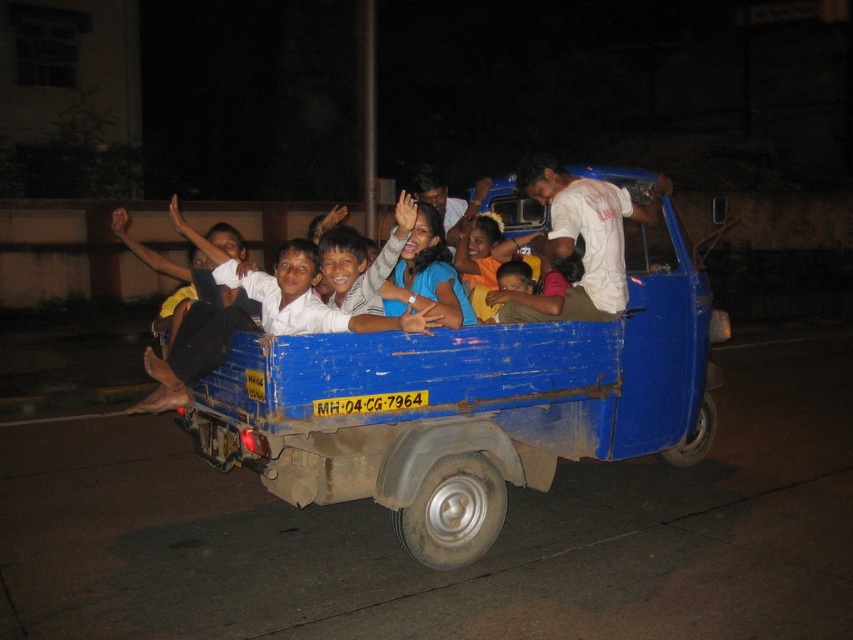
You are a passenger in the blue auto rickshaw and you want to move from the point at coordinate point (633, 336) to the point at coordinate point (585, 188). Which direction should you move in?

The point at coordinate point (633, 336) is behind the point at coordinate point (585, 188). To move from the point at coordinate point (633, 336) to the point at coordinate point (585, 188), you should move forward.

You are a delivery person who needs to place a package between the blue matte truck at center and the white cotton shirt at upper center. The package is 28 inches long. Will it fit between them?

The distance between the blue matte truck at center and the white cotton shirt at upper center is 30.63 inches. Since the package is 28 inches long, it will fit between them with 2.63 inches of space remaining.